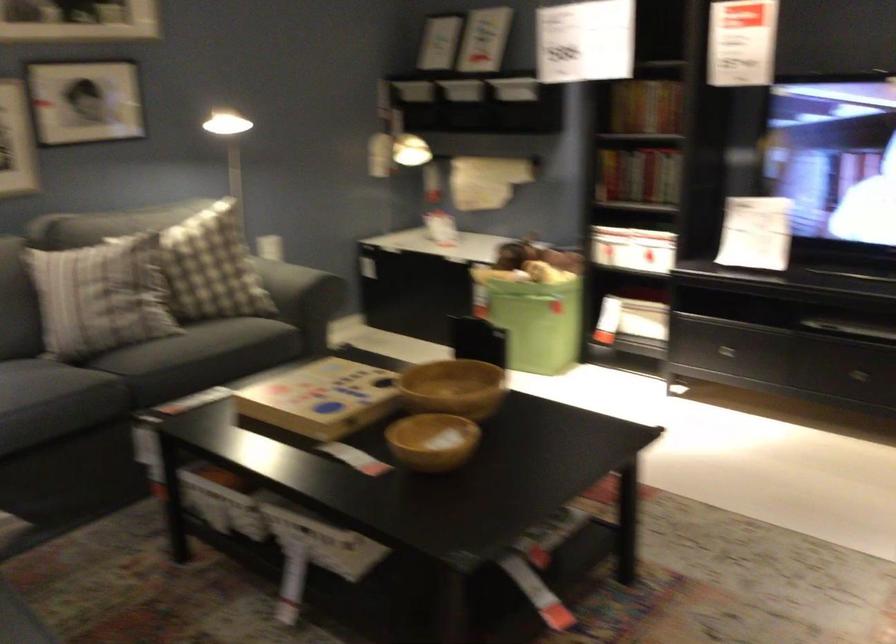
The location [99,296] corresponds to which object?

It refers to a striped pillow.